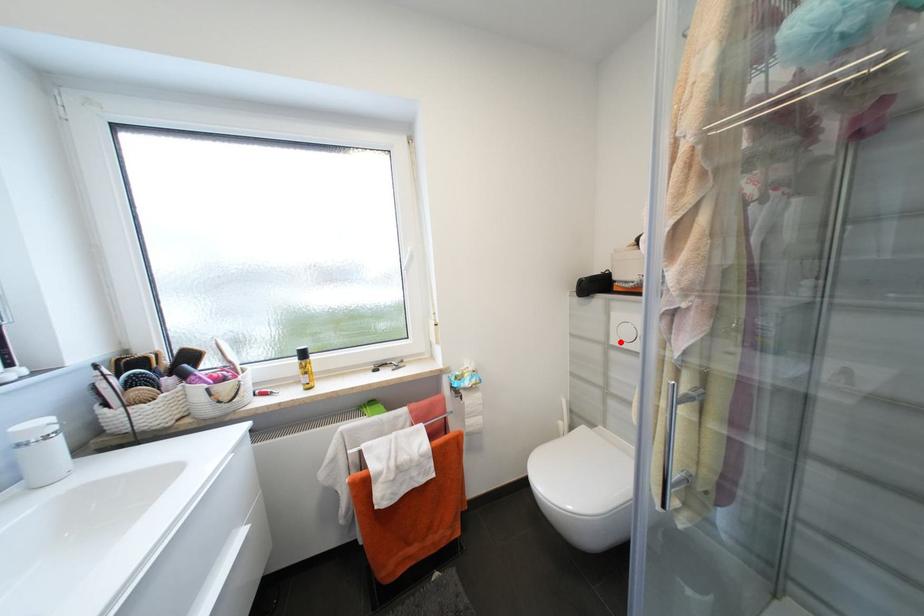
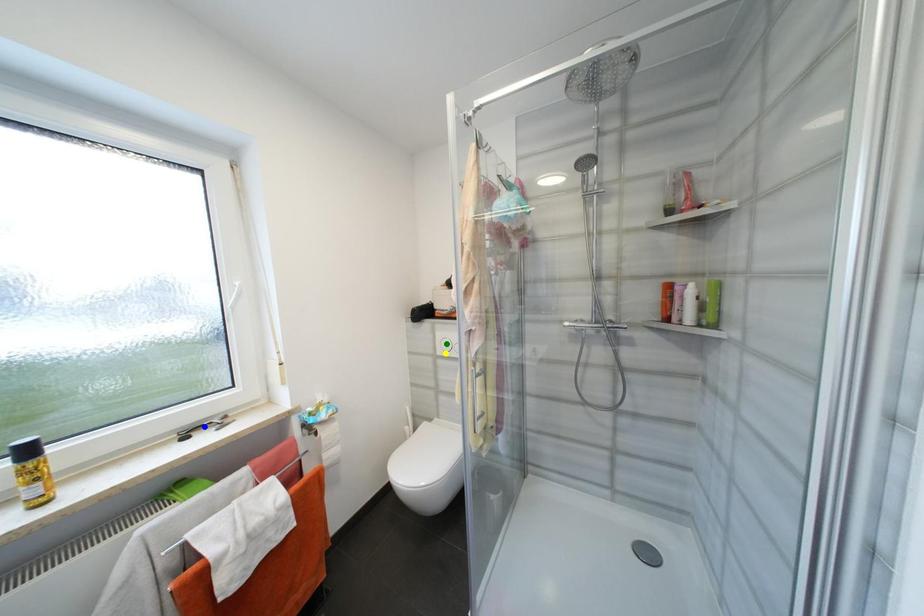
Question: I am providing you with two images of the same scene from different viewpoints. A red point is marked on the first image. You are given multiple points on the second image. Can you choose the point in image 2 that corresponds to the point in image 1?

Choices:
 (A) yellow point
 (B) green point
 (C) blue point

Answer: (A)